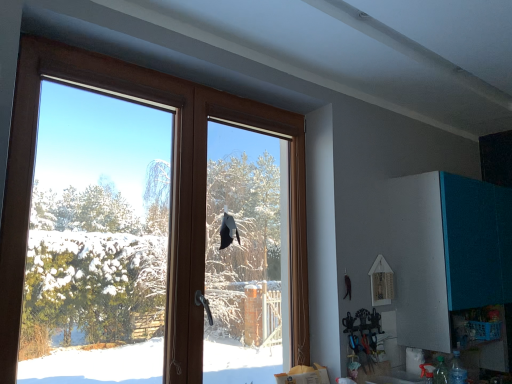
Where is `brown wood window at center`? brown wood window at center is located at coordinates (170, 189).

Describe the element at coordinates (170, 189) in the screenshot. I see `brown wood window at center` at that location.

Where is `brown wood window at center`? brown wood window at center is located at coordinates coord(170,189).